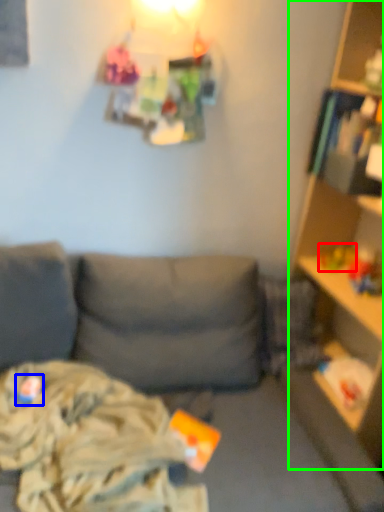
Question: Which object is positioned farthest from toy (highlighted by a red box)? Select from toy (highlighted by a blue box) and shelf (highlighted by a green box).

Choices:
 (A) toy
 (B) shelf

Answer: (A)